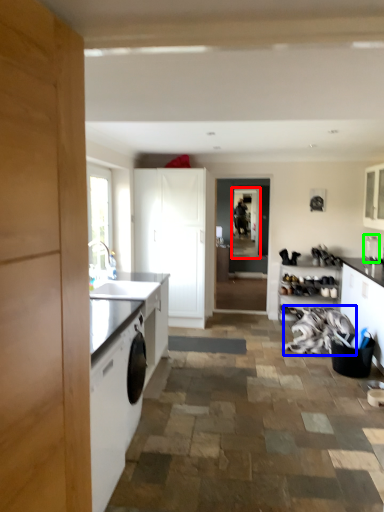
Question: Which object is positioned closest to screen door (highlighted by a red box)? Select from laundry (highlighted by a blue box) and appliance (highlighted by a green box).

Choices:
 (A) laundry
 (B) appliance

Answer: (A)